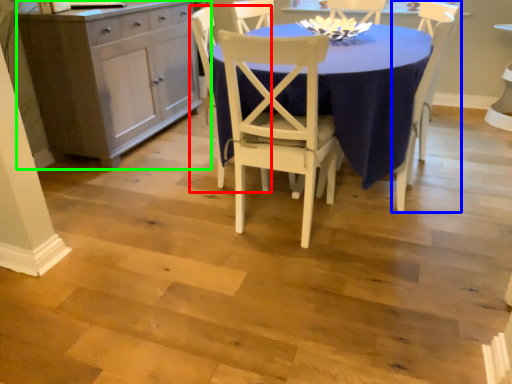
Question: Considering the real-world distances, which object is closest to chair (highlighted by a red box)? chair (highlighted by a blue box) or cabinetry (highlighted by a green box).

Choices:
 (A) chair
 (B) cabinetry

Answer: (B)